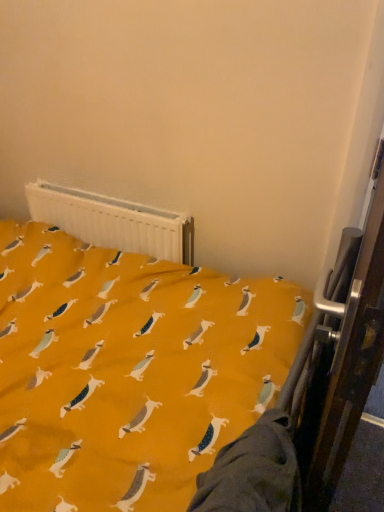
Describe the element at coordinates (113, 222) in the screenshot. I see `white plastic radiator at upper center` at that location.

In order to face white plastic radiator at upper center, should I rotate leftwards or rightwards?

Rotate left and turn 11.703 degrees.

This screenshot has height=512, width=384. Find the location of `white plastic radiator at upper center`. white plastic radiator at upper center is located at coordinates (113, 222).

Where is `white plastic radiator at upper center`? The image size is (384, 512). white plastic radiator at upper center is located at coordinates (113, 222).